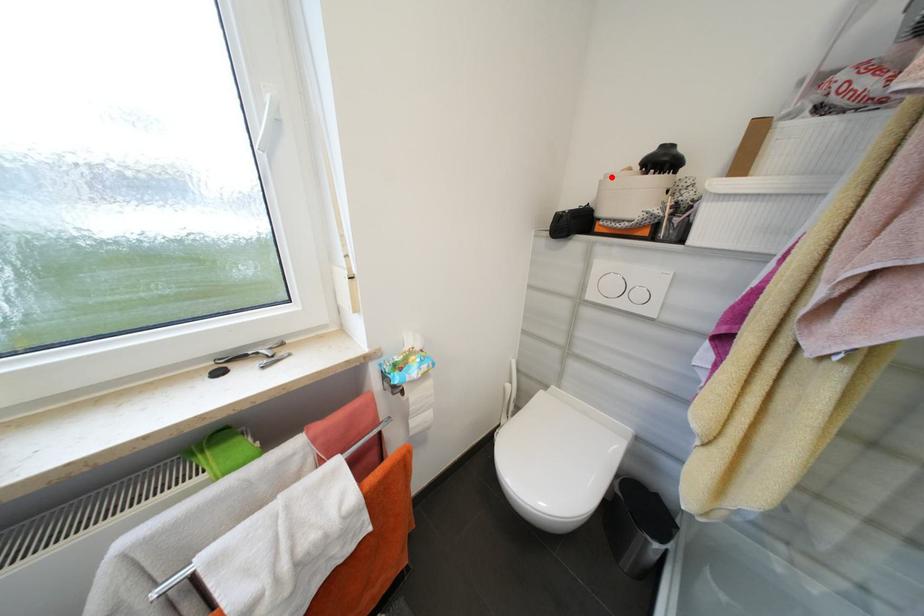
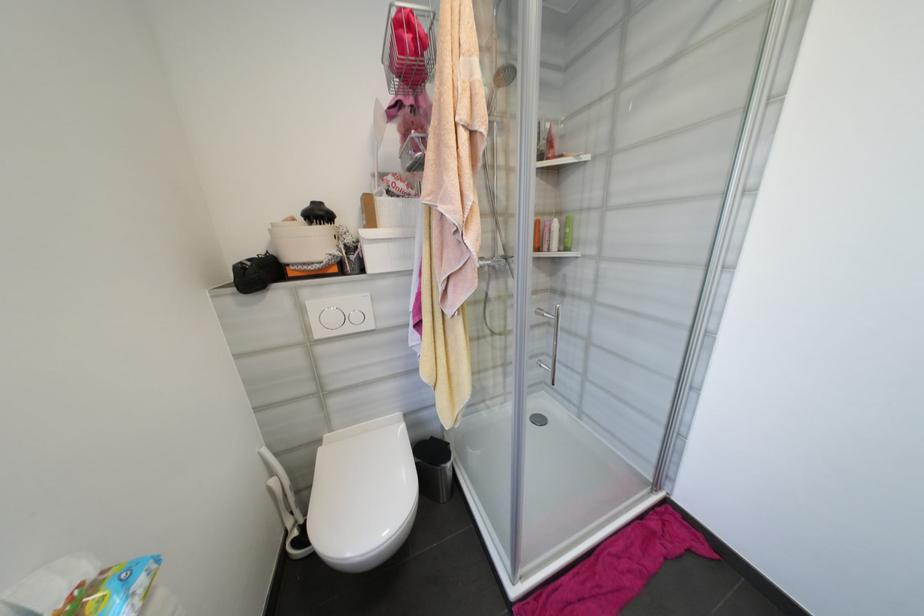
Where in the second image is the point corresponding to the highlighted location from the first image?

(280, 225)